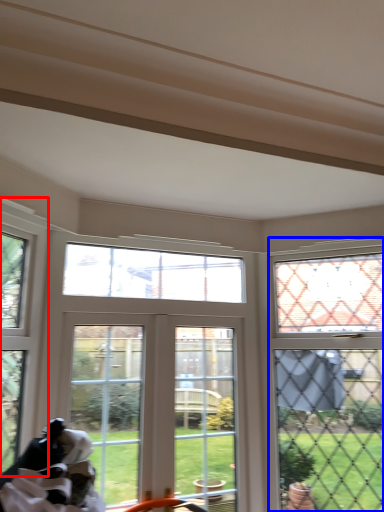
Question: Which object is further to the camera taking this photo, window (highlighted by a red box) or window (highlighted by a blue box)?

Choices:
 (A) window
 (B) window

Answer: (B)